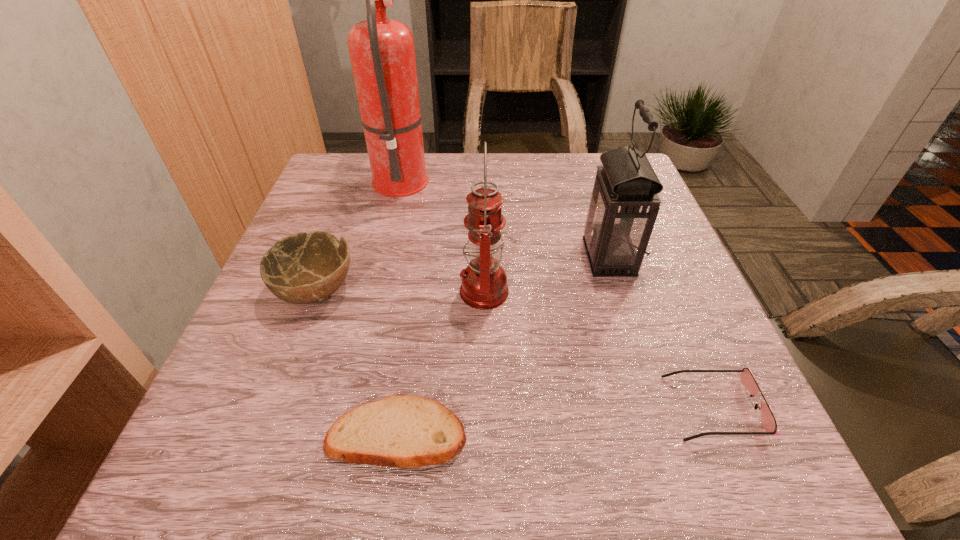
Locate an element on the screen. This screenshot has height=540, width=960. vacant area that lies between the oil lamp and the bowl is located at coordinates (400, 291).

Locate an element on the screen. Image resolution: width=960 pixels, height=540 pixels. free point between the oil lamp and the fourth tallest object is located at coordinates (400, 291).

The image size is (960, 540). What are the coordinates of `object that is the third closest to the fire extinguisher` in the screenshot? It's located at (624, 204).

Select which object is the fourth closest to the fire extinguisher. Please provide its 2D coordinates. Your answer should be formatted as a tuple, i.e. [(x, y)], where the tuple contains the x and y coordinates of a point satisfying the conditions above.

[(403, 431)]

In order to click on vacant position in the image that satisfies the following two spatial constraints: 1. with the handle and hose on the pita bread; 2. on the right side of the farthest object in this screenshot , I will do `click(340, 434)`.

I want to click on vacant space that satisfies the following two spatial constraints: 1. on the front side of the third shortest object; 2. on the left side of the oil lamp, so click(317, 291).